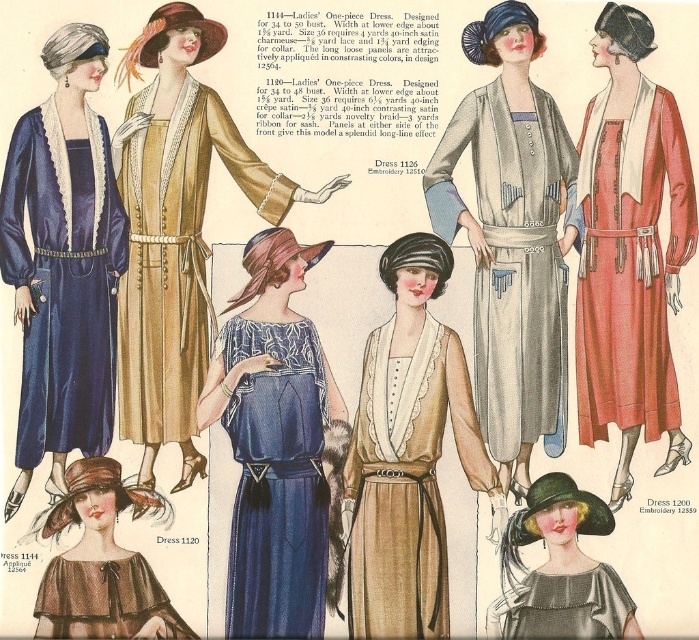
Which is below, matte gold dress at center or matte brown fabric dress at lower left?

matte brown fabric dress at lower left is below.

Is matte gold dress at center above matte brown fabric dress at lower left?

Yes.

I want to click on matte gold dress at center, so 175,228.

Is matte blue silk dress at left below matte red dress at right?

Correct, matte blue silk dress at left is located below matte red dress at right.

Who is positioned more to the right, matte blue silk dress at left or matte red dress at right?

matte red dress at right is more to the right.

Is point (66, 198) less distant than point (640, 328)?

Yes, point (66, 198) is in front of point (640, 328).

Where is `matte blue silk dress at left`? matte blue silk dress at left is located at coordinates (64, 260).

Between point (254, 237) and point (180, 20), which one is positioned in front?

Positioned in front is point (254, 237).

Is velvet-like brown hat at center thinner than velvet brown hat at upper left?

Incorrect, velvet-like brown hat at center's width is not less than velvet brown hat at upper left's.

Does point (284, 252) come behind point (196, 60)?

No, it is in front of (196, 60).

Locate an element on the screen. The height and width of the screenshot is (640, 699). velvet-like brown hat at center is located at coordinates (278, 252).